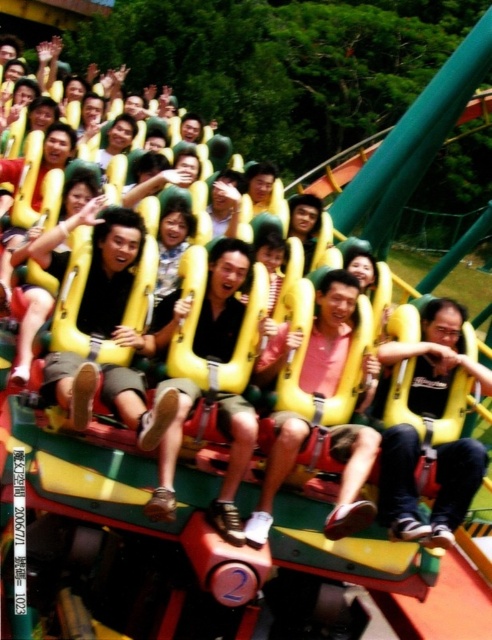
Question: Is dark blue jeans at center bigger than pink matte shirt at center?

Choices:
 (A) yes
 (B) no

Answer: (B)

Question: Estimate the real-world distances between objects in this image. Which object is closer to the matte black shirt at center?

Choices:
 (A) pink matte shirt at center
 (B) dark blue jeans at center

Answer: (A)

Question: Estimate the real-world distances between objects in this image. Which object is closer to the matte black shirt at center?

Choices:
 (A) dark blue jeans at center
 (B) pink matte shirt at center

Answer: (B)

Question: Can you confirm if pink matte shirt at center is wider than matte black shirt at center?

Choices:
 (A) yes
 (B) no

Answer: (A)

Question: Which is farther from the dark blue jeans at center?

Choices:
 (A) pink matte shirt at center
 (B) matte black shirt at center

Answer: (B)

Question: Does pink matte shirt at center appear under matte black shirt at center?

Choices:
 (A) yes
 (B) no

Answer: (A)